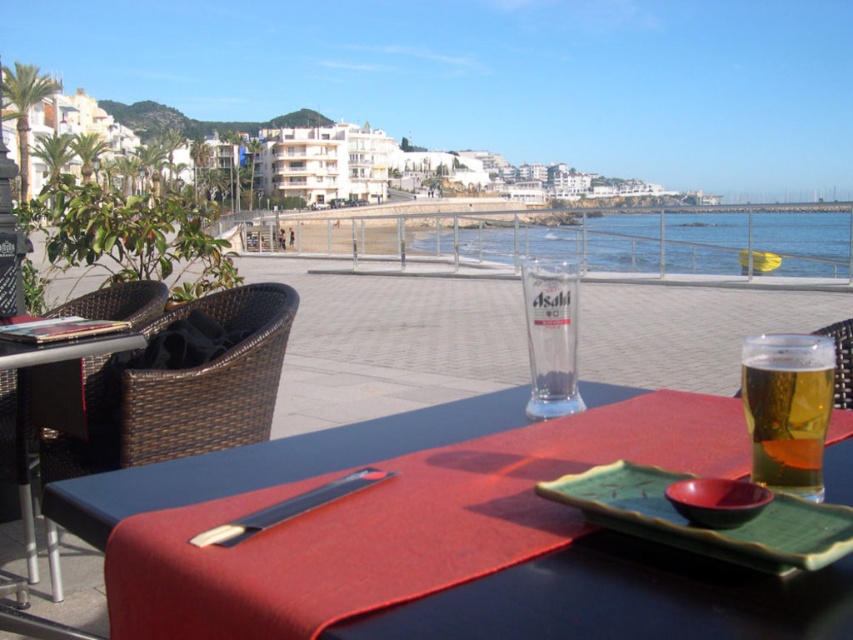
Does green textured tray at lower right have a greater height compared to woven wicker chair at lower center?

No, green textured tray at lower right is not taller than woven wicker chair at lower center.

Between green textured tray at lower right and woven wicker chair at lower center, which one appears on the left side from the viewer's perspective?

green textured tray at lower right

Locate an element on the screen. The image size is (853, 640). green textured tray at lower right is located at coordinates (701, 528).

Can you confirm if smooth dark blue table at center is positioned to the right of woven wicker chair at lower center?

In fact, smooth dark blue table at center is to the left of woven wicker chair at lower center.

Who is positioned more to the right, smooth dark blue table at center or woven wicker chair at lower center?

woven wicker chair at lower center

Is point (728, 600) positioned after point (843, 403)?

No, (728, 600) is in front of (843, 403).

Locate an element on the screen. The image size is (853, 640). smooth dark blue table at center is located at coordinates (618, 600).

Between brown wicker chair at left and clear glass beer at center, which one has less height?

With less height is clear glass beer at center.

Between brown wicker chair at left and clear glass beer at center, which one has more height?

brown wicker chair at left is taller.

At what (x,y) coordinates should I click in order to perform the action: click on brown wicker chair at left. Please return your answer as a coordinate pair (x, y). The image size is (853, 640). Looking at the image, I should click on (212, 381).